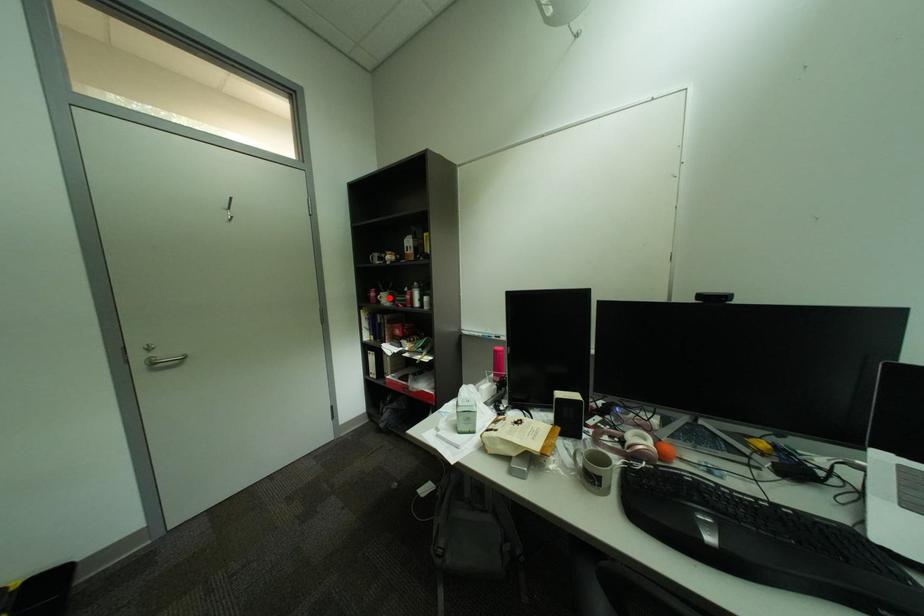
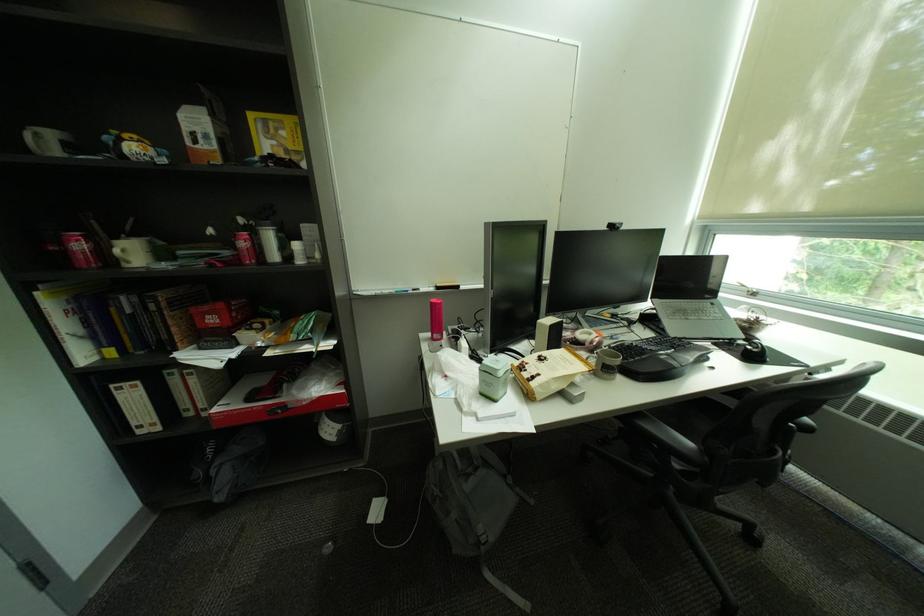
In the second image, find the point that corresponds to the highlighted location in the first image.

(128, 252)